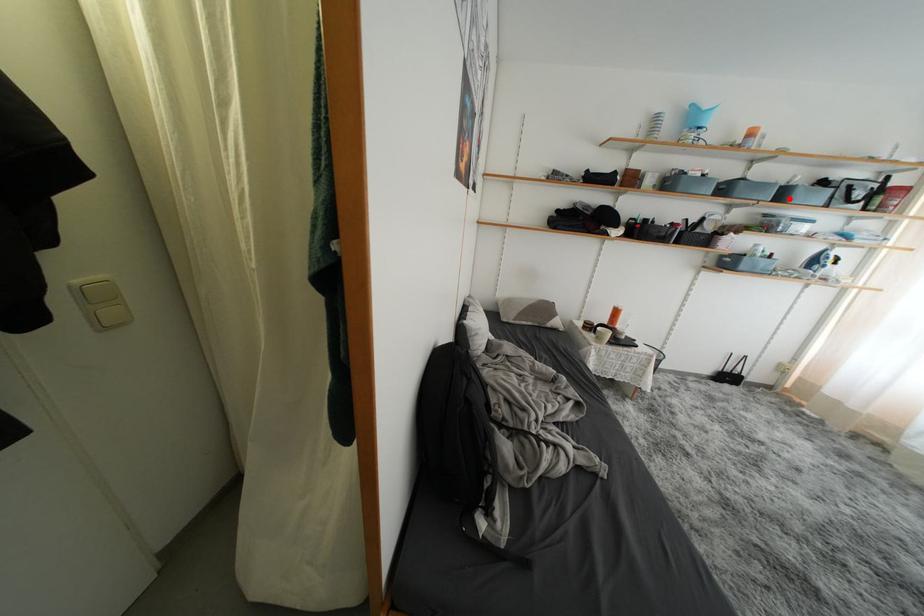
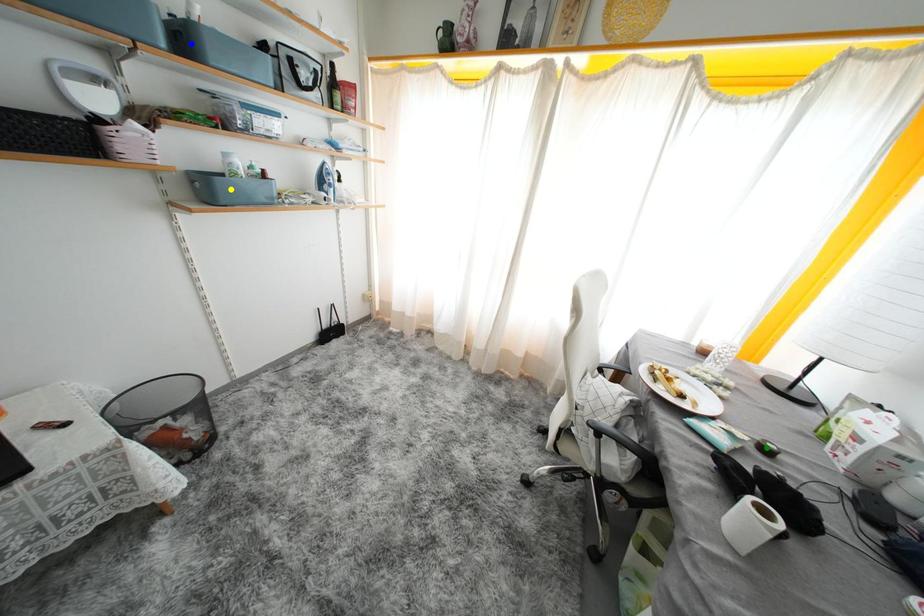
Question: I am providing you with two images of the same scene from different viewpoints. A red point is marked on the first image. You are given multiple points on the second image. Can you choose the point in image 2 that corresponds to the point in image 1?

Choices:
 (A) green point
 (B) yellow point
 (C) blue point

Answer: (C)